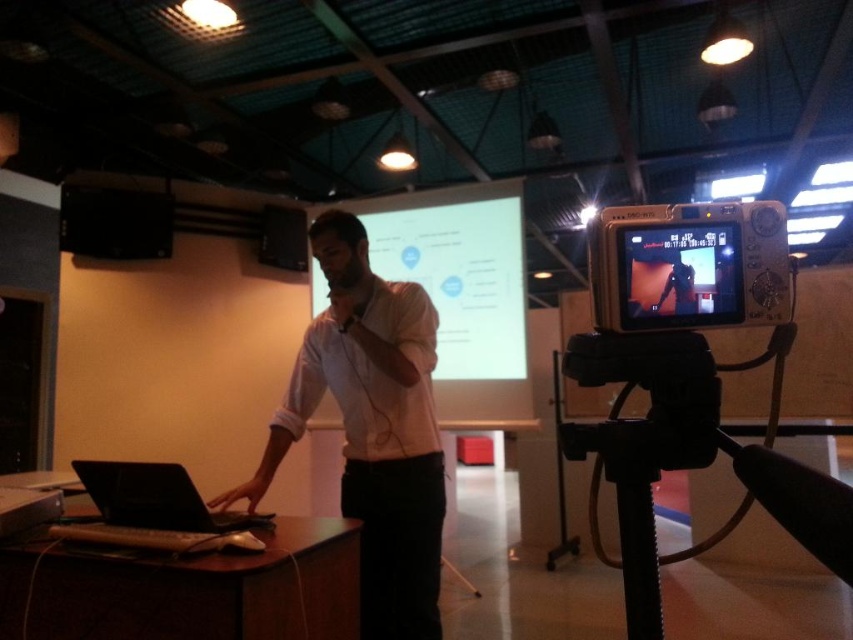
Does white matte shirt at center come in front of silver plastic video camera at center?

No, it is not.

In the scene shown: Between white matte shirt at center and silver plastic video camera at center, which one is positioned higher?

silver plastic video camera at center is above.

The height and width of the screenshot is (640, 853). I want to click on white matte shirt at center, so click(x=370, y=428).

Is silver plastic video camera at center bigger than matte black laptop at center?

Yes.

Is silver plastic video camera at center to the left of matte black laptop at center from the viewer's perspective?

Incorrect, silver plastic video camera at center is not on the left side of matte black laptop at center.

Which is in front, point (605, 310) or point (672, 264)?

Point (605, 310) is more forward.

Find the location of `silver plastic video camera at center`. silver plastic video camera at center is located at coordinates (688, 266).

Is point (850, 492) more distant than point (111, 486)?

No, it is in front of (111, 486).

Who is more distant from viewer, (595, 376) or (177, 472)?

The point (177, 472) is more distant.

Where is `black plastic tripod at lower right`? This screenshot has width=853, height=640. black plastic tripod at lower right is located at coordinates (686, 456).